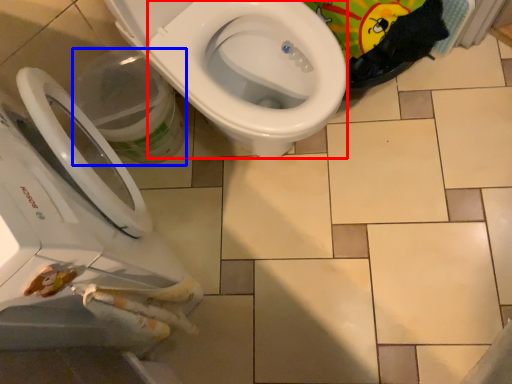
Question: Which object appears closest to the camera in this image, bidet (highlighted by a red box) or potty (highlighted by a blue box)?

Choices:
 (A) bidet
 (B) potty

Answer: (A)